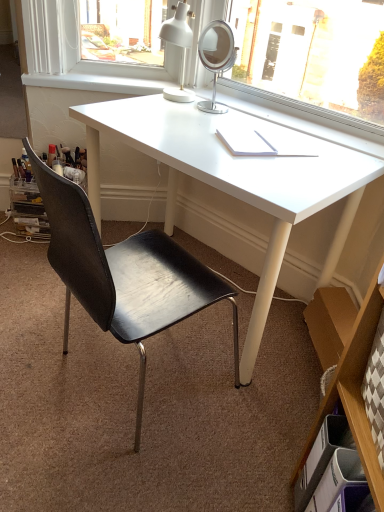
Find the location of a particular element. This screenshot has height=512, width=384. black leather chair at center is located at coordinates (124, 274).

This screenshot has height=512, width=384. Describe the element at coordinates (353, 388) in the screenshot. I see `brown cardboard bookshelf at lower right` at that location.

Where is `white plastic drawer at lower right`? The width and height of the screenshot is (384, 512). white plastic drawer at lower right is located at coordinates (331, 472).

Locate an element on the screen. The width and height of the screenshot is (384, 512). black leather chair at center is located at coordinates (124, 274).

From the image's perspective, between white glossy desk at center and brown cardboard bookshelf at lower right, which one is located above?

white glossy desk at center is shown above in the image.

Is point (337, 233) less distant than point (372, 457)?

No.

At what (x,y) coordinates should I click in order to perform the action: click on bookshelf located above the white glossy desk at center (from a real-world perspective). Please return your answer as a coordinate pair (x, y). Image resolution: width=384 pixels, height=512 pixels. Looking at the image, I should click on (353, 388).

Is white glossy desk at center thinner than brown cardboard bookshelf at lower right?

No.

How many degrees apart are the facing directions of white glossy desk at center and white smooth window sill at upper center?

48.4 degrees.

Considering the sizes of white glossy desk at center and white smooth window sill at upper center in the image, is white glossy desk at center taller or shorter than white smooth window sill at upper center?

In the image, white glossy desk at center appears to be taller than white smooth window sill at upper center.

Is white glossy desk at center positioned behind white smooth window sill at upper center?

No.

From a real-world perspective, which is physically below, white glossy desk at center or white smooth window sill at upper center?

From a 3D spatial view, white glossy desk at center is below.

Is black leather chair at center beside white plastic drawer at lower right?

They are not placed beside each other.

Considering the relative positions of black leather chair at center and white plastic drawer at lower right in the image provided, is black leather chair at center to the right of white plastic drawer at lower right from the viewer's perspective?

No, black leather chair at center is not to the right of white plastic drawer at lower right.

Is white plastic drawer at lower right inside black leather chair at center?

Actually, white plastic drawer at lower right is outside black leather chair at center.

Which is less distant, (65, 198) or (348, 506)?

Positioned in front is point (348, 506).

Is white smooth window sill at upper center not inside white glossy desk at center?

Yes.

Does white smooth window sill at upper center have a larger size compared to white glossy desk at center?

Actually, white smooth window sill at upper center might be smaller than white glossy desk at center.

Is white smooth window sill at upper center closer to the viewer compared to white glossy desk at center?

No, it is behind white glossy desk at center.

In the scene shown: From a real-world perspective, does white smooth window sill at upper center sit lower than white glossy desk at center?

Actually, white smooth window sill at upper center is physically above white glossy desk at center in the real world.

Is black leather chair at center situated inside white smooth window sill at upper center or outside?

The correct answer is: outside.

Which point is more forward, (205, 269) or (49, 87)?

Positioned in front is point (205, 269).

Are black leather chair at center and white smooth window sill at upper center located far from each other?

Yes, black leather chair at center is far from white smooth window sill at upper center.

Does black leather chair at center have a smaller size compared to white smooth window sill at upper center?

No.

Which object is thinner, white plastic drawer at lower right or white glossy desk at center?

white plastic drawer at lower right is thinner.

Would you say white plastic drawer at lower right is a long distance from white glossy desk at center?

No.

From the image's perspective, is white plastic drawer at lower right above or below white glossy desk at center?

Based on their image positions, white plastic drawer at lower right is located beneath white glossy desk at center.

Can you confirm if white plastic drawer at lower right is bigger than white glossy desk at center?

No.

Is white plastic drawer at lower right not within white smooth window sill at upper center?

Yes, white plastic drawer at lower right is outside of white smooth window sill at upper center.

Is white plastic drawer at lower right thinner than white smooth window sill at upper center?

No.

Looking at this image, from a real-world perspective, is white plastic drawer at lower right physically below white smooth window sill at upper center?

Yes, from a real-world perspective, white plastic drawer at lower right is under white smooth window sill at upper center.

Image resolution: width=384 pixels, height=512 pixels. Find the location of `bookshelf lying below the white glossy desk at center (from the image's perspective)`. bookshelf lying below the white glossy desk at center (from the image's perspective) is located at coordinates (353, 388).

Locate an element on the screen. The height and width of the screenshot is (512, 384). window sill located above the white glossy desk at center (from a real-world perspective) is located at coordinates (96, 83).

Considering their positions, is white glossy desk at center positioned further to black leather chair at center than white plastic drawer at lower right?

Among the two, white plastic drawer at lower right is located further to black leather chair at center.

Based on their spatial positions, is white plastic drawer at lower right or black leather chair at center closer to white smooth window sill at upper center?

black leather chair at center lies closer to white smooth window sill at upper center than the other object.

Looking at the image, which one is located further to brown cardboard bookshelf at lower right, black leather chair at center or white smooth window sill at upper center?

white smooth window sill at upper center is further to brown cardboard bookshelf at lower right.

From the image, which object appears to be farther from white plastic drawer at lower right, brown cardboard bookshelf at lower right or white glossy desk at center?

The object further to white plastic drawer at lower right is white glossy desk at center.

Looking at the image, which one is located closer to white smooth window sill at upper center, white glossy desk at center or white plastic drawer at lower right?

The object closer to white smooth window sill at upper center is white glossy desk at center.

Looking at this image, from the image, which object appears to be nearer to white smooth window sill at upper center, white plastic drawer at lower right or brown cardboard bookshelf at lower right?

Among the two, brown cardboard bookshelf at lower right is located nearer to white smooth window sill at upper center.

Looking at the image, which one is located closer to white glossy desk at center, brown cardboard bookshelf at lower right or white plastic drawer at lower right?

Based on the image, brown cardboard bookshelf at lower right appears to be nearer to white glossy desk at center.

Estimate the real-world distances between objects in this image. Which object is closer to white glossy desk at center, white plastic drawer at lower right or black leather chair at center?

black leather chair at center is positioned closer to the anchor white glossy desk at center.

This screenshot has height=512, width=384. I want to click on bookshelf that lies between white glossy desk at center and white plastic drawer at lower right from top to bottom, so click(353, 388).

Where is `desk positioned between brown cardboard bookshelf at lower right and white smooth window sill at upper center from near to far`? This screenshot has width=384, height=512. desk positioned between brown cardboard bookshelf at lower right and white smooth window sill at upper center from near to far is located at coordinates (228, 177).

Where is `desk between white smooth window sill at upper center and white plastic drawer at lower right in the vertical direction`? Image resolution: width=384 pixels, height=512 pixels. desk between white smooth window sill at upper center and white plastic drawer at lower right in the vertical direction is located at coordinates (228, 177).

At what (x,y) coordinates should I click in order to perform the action: click on desk between black leather chair at center and white smooth window sill at upper center from front to back. Please return your answer as a coordinate pair (x, y). Looking at the image, I should click on (228, 177).